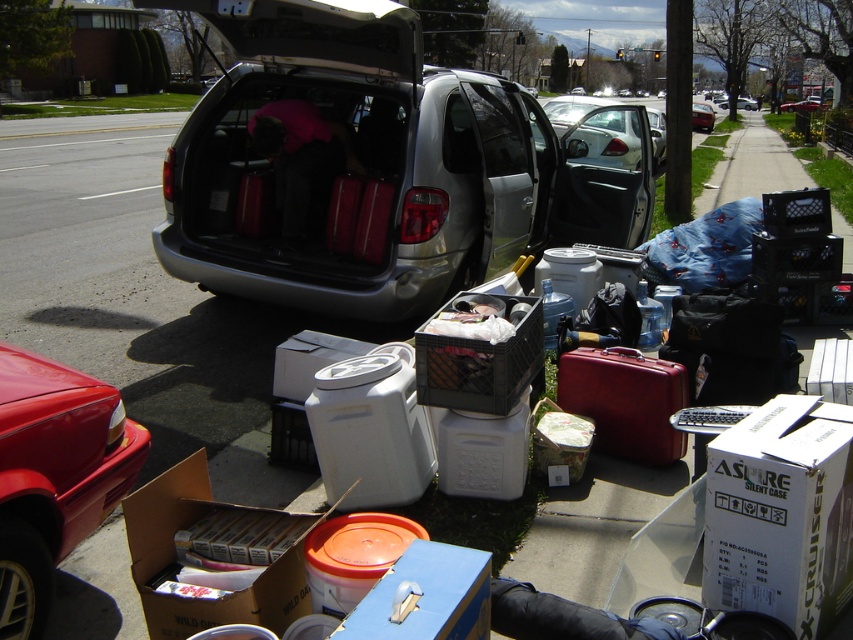
Question: Estimate the real-world distances between objects in this image. Which object is farther from the white cardboard box at lower right?

Choices:
 (A) silver metallic minivan at center
 (B) shiny red car at lower left
 (C) cardboard box at lower left

Answer: (A)

Question: Does white cardboard box at lower right have a larger size compared to metallic silver minivan at center?

Choices:
 (A) no
 (B) yes

Answer: (A)

Question: Which point is closer to the camera?

Choices:
 (A) silver metallic minivan at center
 (B) metallic silver minivan at center
 (C) shiny red car at lower left
 (D) blue plastic box at lower center

Answer: (D)

Question: In this image, where is shiny red car at lower left located relative to cardboard box at lower left?

Choices:
 (A) above
 (B) below

Answer: (A)

Question: Among these points, which one is nearest to the camera?

Choices:
 (A) (279, 611)
 (B) (462, 608)

Answer: (B)

Question: From the image, what is the correct spatial relationship of white cardboard box at lower right in relation to cardboard box at lower left?

Choices:
 (A) right
 (B) left

Answer: (A)